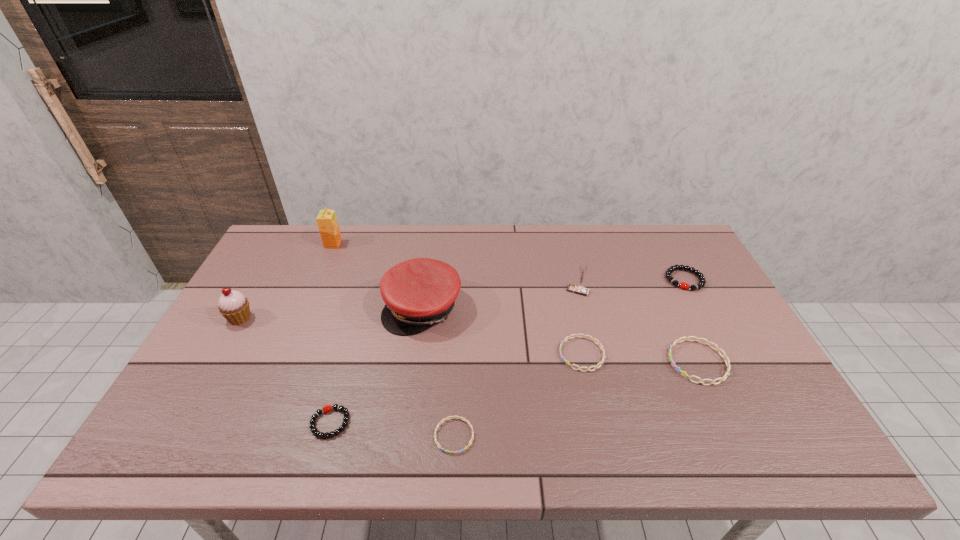
Find the location of a particular element. The image size is (960, 540). free space in the image that satisfies the following two spatial constraints: 1. on the surface of the rightmost blue bracelet showing star-shaped elements; 2. on the surface of the smallest blue bracelet showing star-shaped elements is located at coordinates (732, 436).

The image size is (960, 540). I want to click on vacant space that satisfies the following two spatial constraints: 1. on the surface of the second smallest blue bracelet showing star-shaped elements; 2. on the surface of the smallest blue bracelet showing star-shaped elements, so click(600, 436).

Identify the location of free space that satisfies the following two spatial constraints: 1. on the front side of the farthest bracelet; 2. on the surface of the biggest blue bracelet showing star-shaped elements. (728, 362).